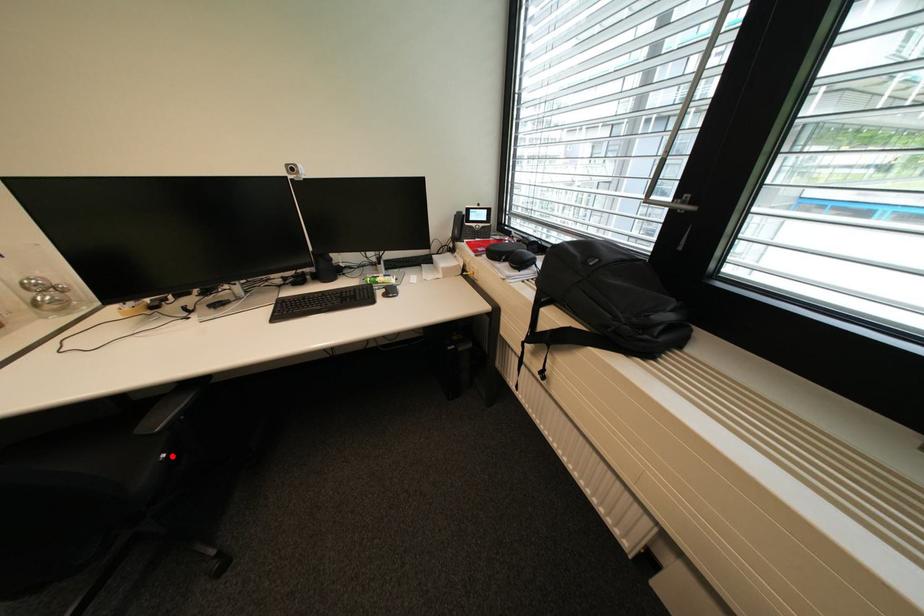
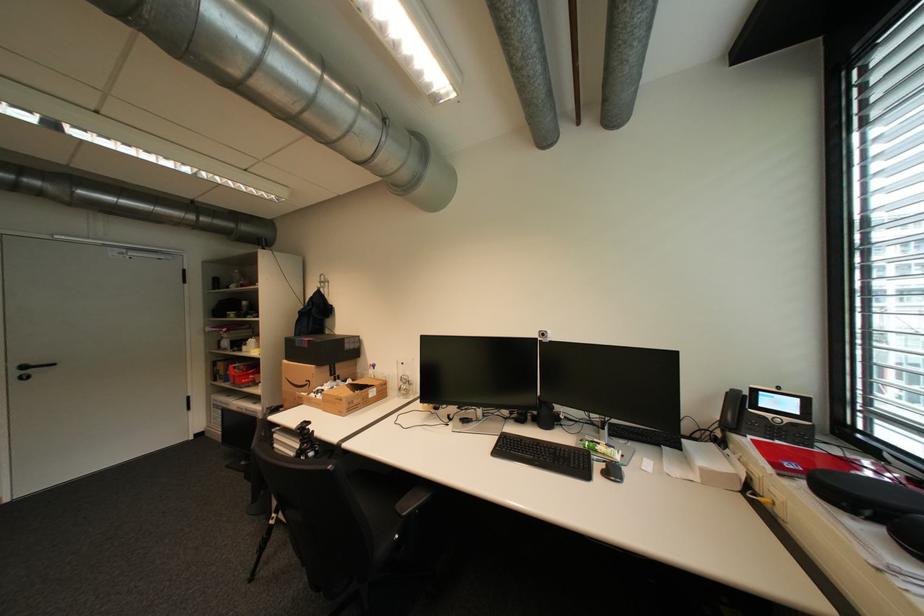
Question: I am providing you with two images of the same scene from different viewpoints. Image1 has a red point marked. In image2, the corresponding 3D location appears at what relative position? Reply with the corresponding letter.

Choices:
 (A) Closer
 (B) Farther

Answer: (B)